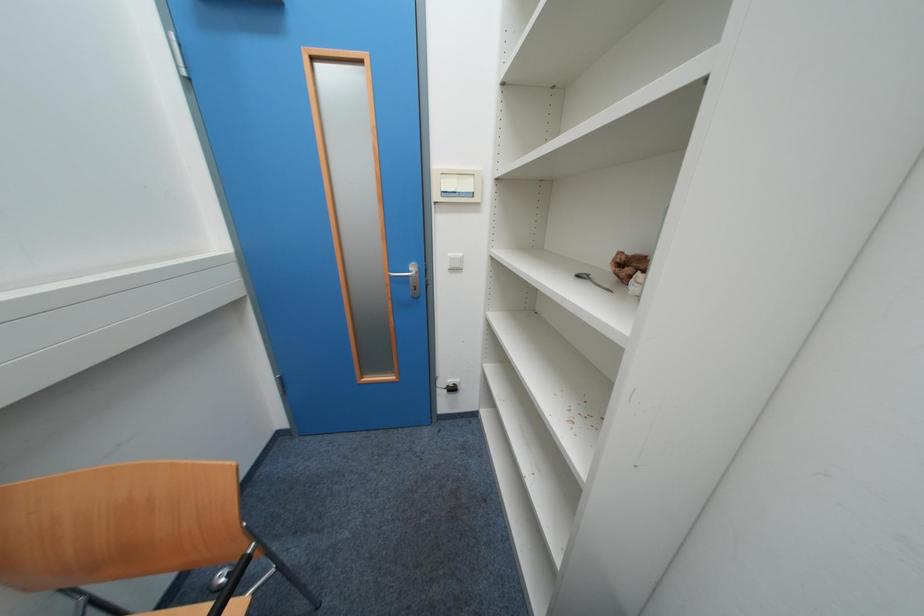
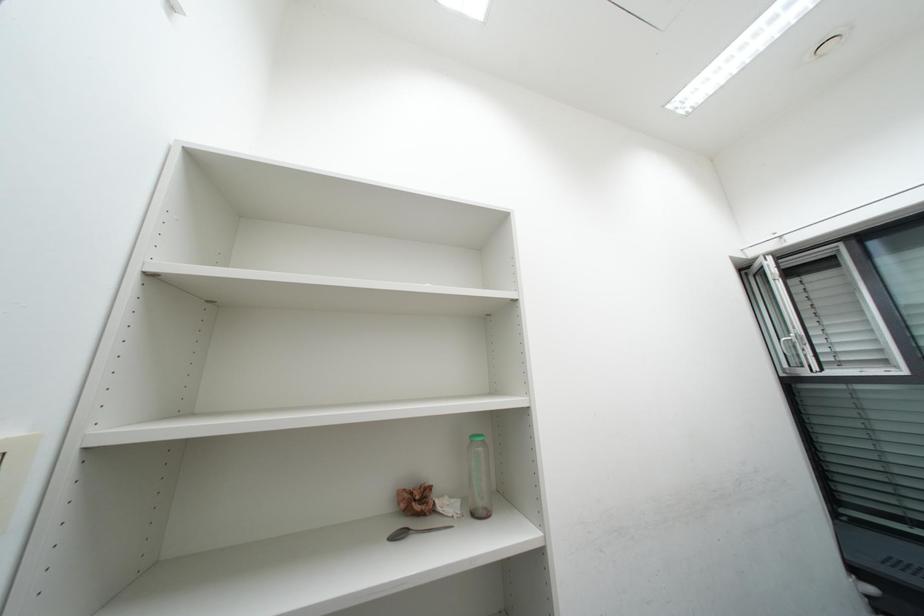
Question: The camera is either moving clockwise (left) or counter-clockwise (right) around the object. The first image is from the beginning of the video and the second image is from the end. Is the camera moving left or right when shooting the video?

Choices:
 (A) Left
 (B) Right

Answer: (A)